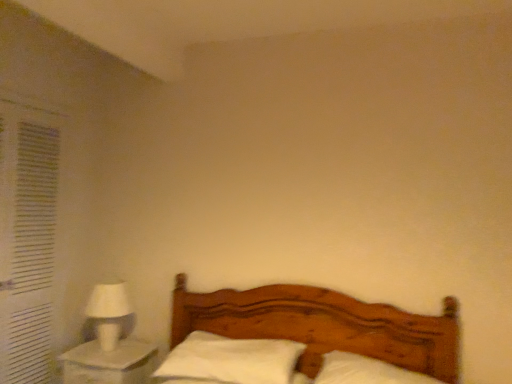
Question: Which direction should I rotate to face white soft pillow at center, acting as the 2th pillow starting from the left, — up or down?

Choices:
 (A) down
 (B) up

Answer: (A)

Question: From a real-world perspective, is white soft pillow at center, the first pillow from the left, positioned over white soft pillow at center, placed as the first pillow when sorted from right to left, based on gravity?

Choices:
 (A) yes
 (B) no

Answer: (A)

Question: Is white soft pillow at center, the first pillow from the left, looking in the opposite direction of white soft pillow at center, acting as the 2th pillow starting from the left?

Choices:
 (A) yes
 (B) no

Answer: (B)

Question: Is white soft pillow at center, which ranks as the 2th pillow in right-to-left order, at the right side of white soft pillow at center, placed as the first pillow when sorted from right to left?

Choices:
 (A) no
 (B) yes

Answer: (A)

Question: Is white soft pillow at center, the first pillow from the left, wider than white soft pillow at center, placed as the first pillow when sorted from right to left?

Choices:
 (A) yes
 (B) no

Answer: (B)

Question: From a real-world perspective, is white soft pillow at center, which ranks as the 2th pillow in right-to-left order, beneath white soft pillow at center, placed as the first pillow when sorted from right to left?

Choices:
 (A) yes
 (B) no

Answer: (B)

Question: Can you see white soft pillow at center, the first pillow from the left, touching white soft pillow at center, acting as the 2th pillow starting from the left?

Choices:
 (A) yes
 (B) no

Answer: (B)

Question: From a real-world perspective, is wooden bed at center positioned over white matte table lamp at left based on gravity?

Choices:
 (A) no
 (B) yes

Answer: (A)

Question: Is wooden bed at center in front of white matte table lamp at left?

Choices:
 (A) no
 (B) yes

Answer: (B)

Question: Does wooden bed at center have a lesser width compared to white matte table lamp at left?

Choices:
 (A) yes
 (B) no

Answer: (B)

Question: Considering the relative sizes of wooden bed at center and white matte table lamp at left in the image provided, is wooden bed at center wider than white matte table lamp at left?

Choices:
 (A) no
 (B) yes

Answer: (B)

Question: Is there a large distance between wooden bed at center and white matte table lamp at left?

Choices:
 (A) no
 (B) yes

Answer: (A)

Question: Is wooden bed at center shorter than white matte table lamp at left?

Choices:
 (A) yes
 (B) no

Answer: (B)

Question: Is the position of white fabric curtain at left more distant than that of wooden bed at center?

Choices:
 (A) no
 (B) yes

Answer: (B)